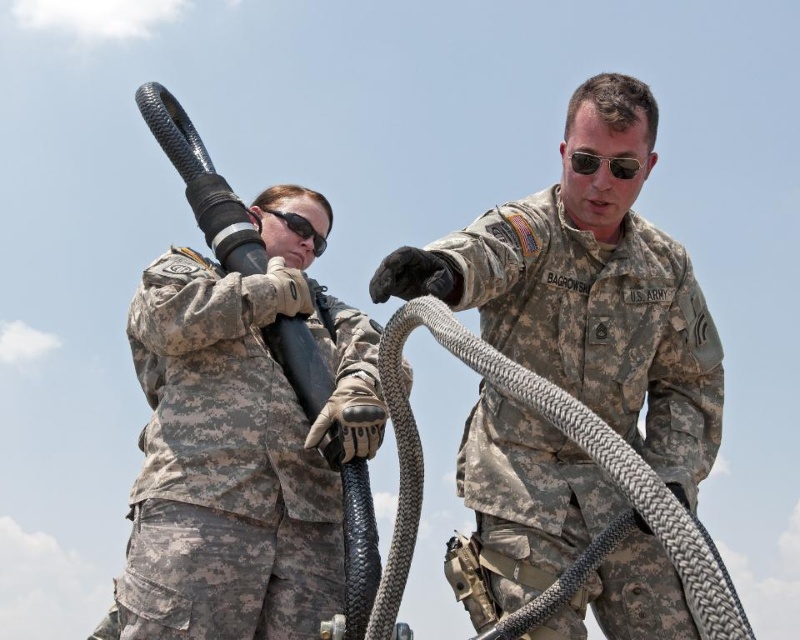
Which of these two, sunglasses at center or black matte goggles at upper center, stands shorter?

Standing shorter between the two is black matte goggles at upper center.

Who is more forward, [621,170] or [297,212]?

Point [621,170]

This screenshot has width=800, height=640. Find the location of `sunglasses at center`. sunglasses at center is located at coordinates (605, 163).

Is camouflage fabric uniform at center above black matte goggles at upper center?

Actually, camouflage fabric uniform at center is below black matte goggles at upper center.

Which is more to the right, camouflage fabric uniform at center or black matte goggles at upper center?

black matte goggles at upper center

Is point (322, 314) farther from camera compared to point (276, 209)?

No, it is in front of (276, 209).

You are a GUI agent. You are given a task and a screenshot of the screen. Output one action in this format:
    pyautogui.click(x=<x>, y=<y>)
    Task: Click on the camouflage fabric uniform at center
    Image resolution: width=800 pixels, height=640 pixels.
    Given the screenshot: What is the action you would take?
    pyautogui.click(x=240, y=444)

Between point (178, 520) and point (596, 166), which one is positioned in front?

Point (596, 166) is in front.

Between camouflage fabric uniform at center and sunglasses at center, which one has more height?

camouflage fabric uniform at center is taller.

Image resolution: width=800 pixels, height=640 pixels. Describe the element at coordinates (240, 444) in the screenshot. I see `camouflage fabric uniform at center` at that location.

This screenshot has height=640, width=800. In order to click on camouflage fabric uniform at center in this screenshot , I will do `click(240, 444)`.